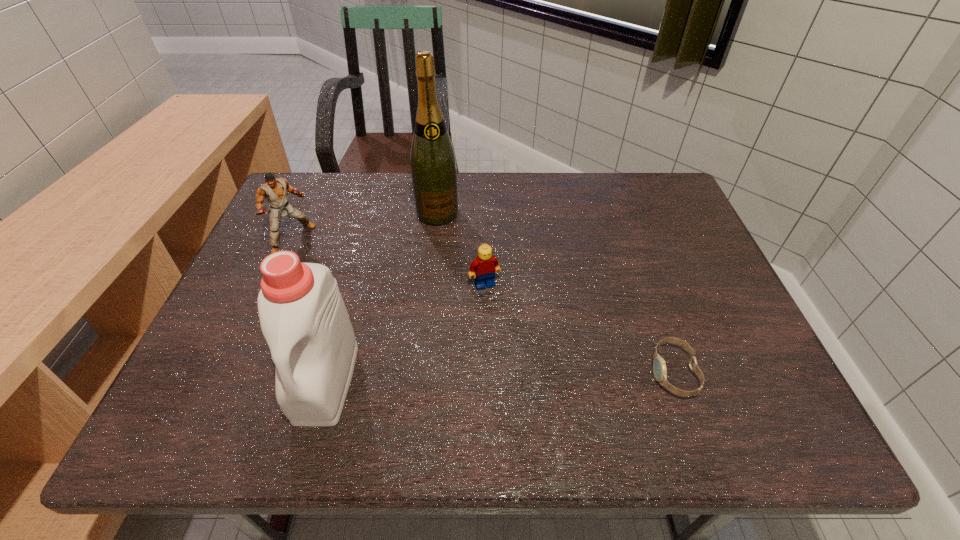
Find the location of a particular element. Image resolution: width=960 pixels, height=540 pixels. free space on the desktop that is between the second object from left to right and the shortest object and is positioned on the front-facing side of the wine bottle is located at coordinates (485, 377).

Identify the location of vacant space on the desktop that is between the detergent and the watch and is positioned on the front-facing side of the leftmost object. (477, 377).

This screenshot has width=960, height=540. In order to click on vacant space on the desktop that is between the detergent and the shortest object and is positioned on the front-facing side of the Lego in this screenshot , I will do coord(525,376).